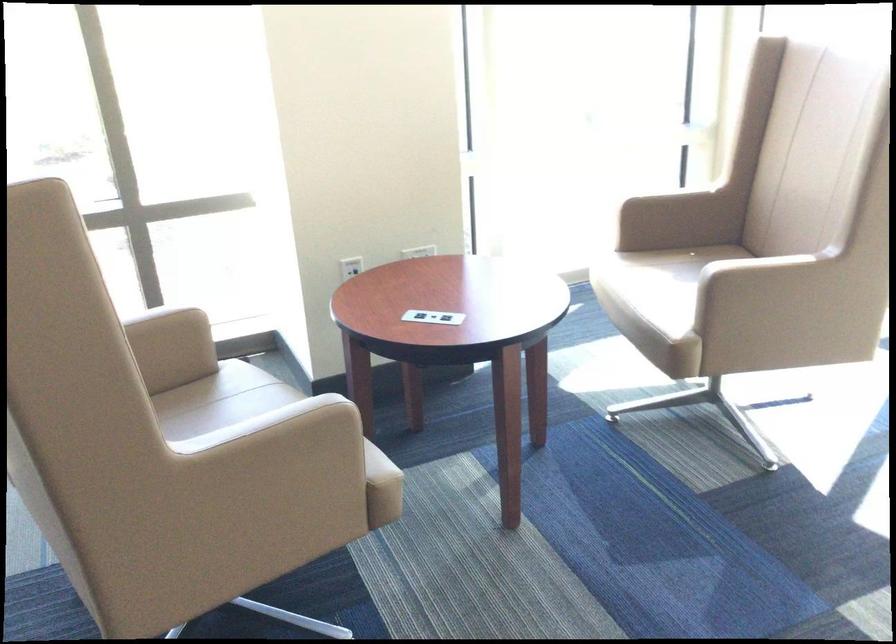
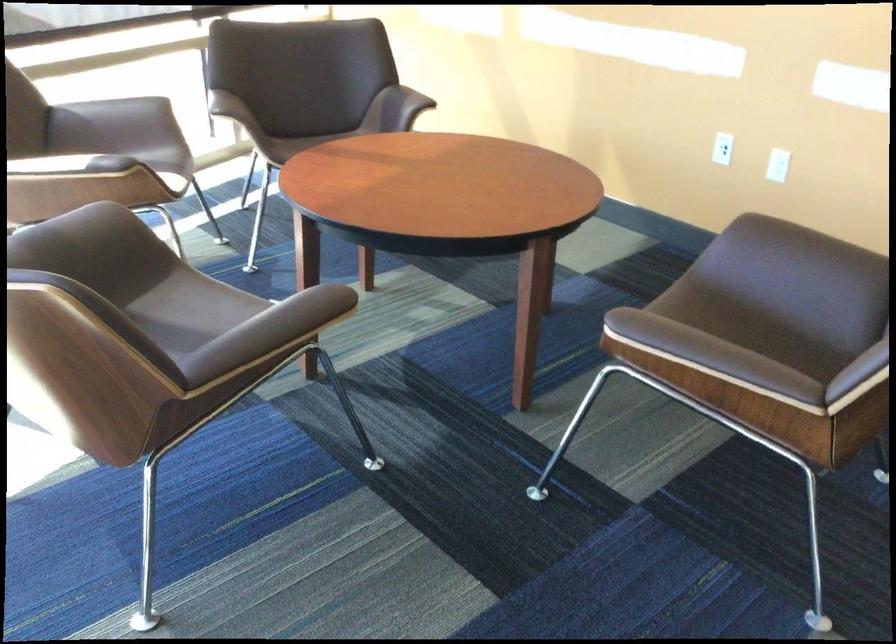
First-person continuous shooting, in which direction is the camera rotating?

The camera rotated toward right-down.